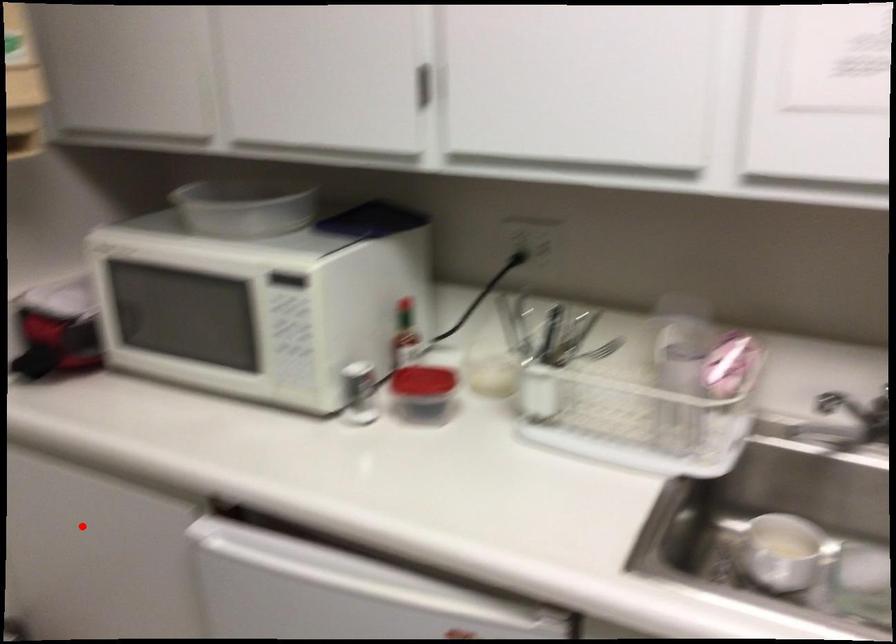
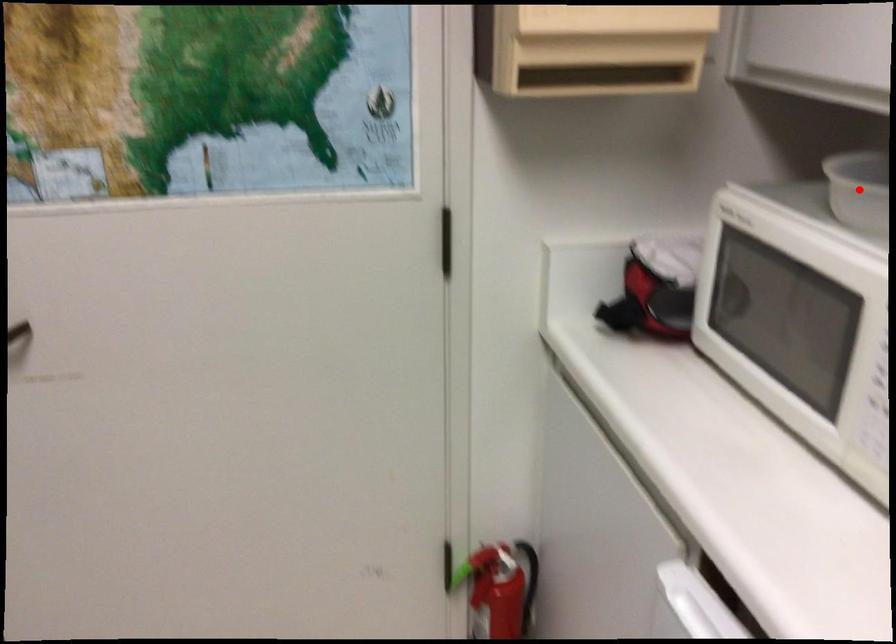
I am providing you with two images of the same scene from different viewpoints. A red point is marked on the first image and another point is marked on the second image. Is the red point in image1 aligned with the point shown in image2?

No